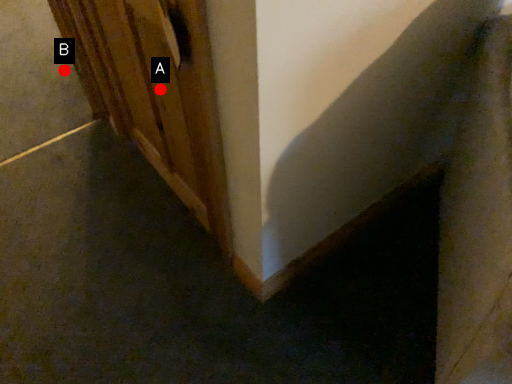
Question: Two points are circled on the image, labeled by A and B beside each circle. Among these points, which one is nearest to the camera?

Choices:
 (A) A is closer
 (B) B is closer

Answer: (A)